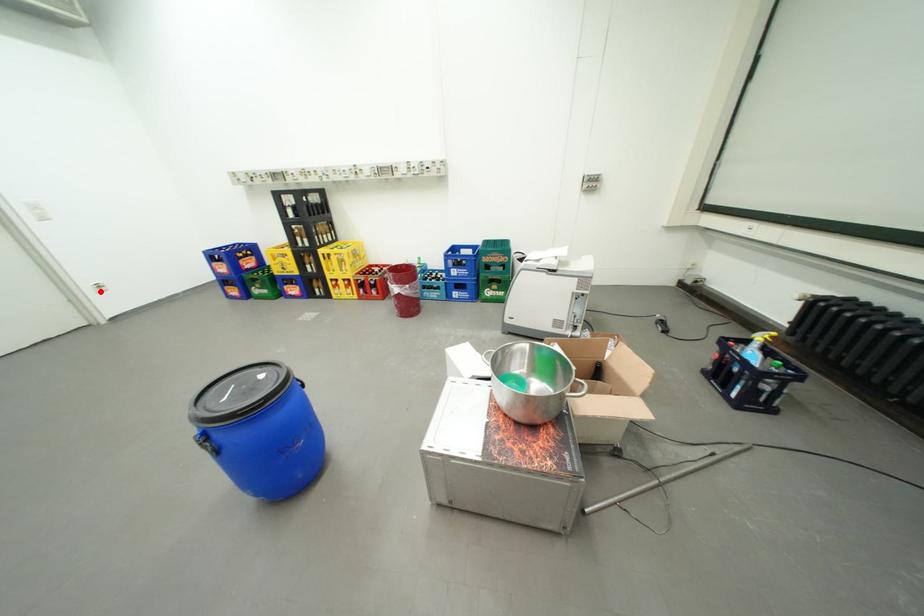
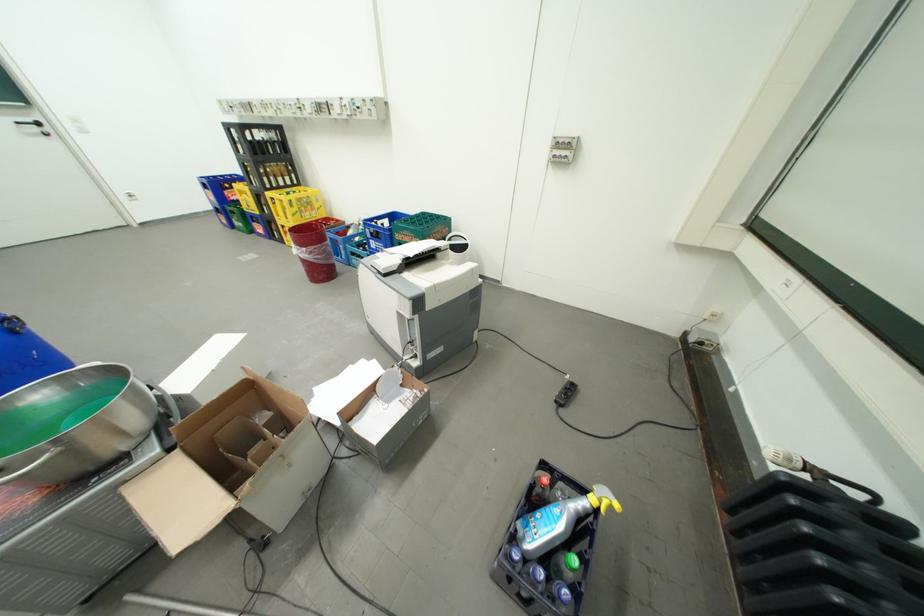
In the second image, find the point that corresponds to the highlighted location in the first image.

(134, 199)